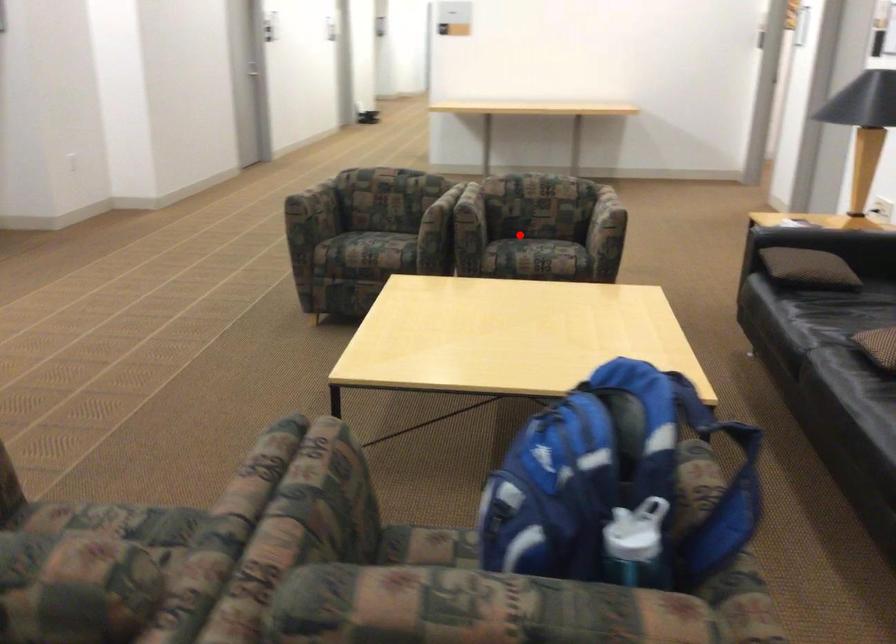
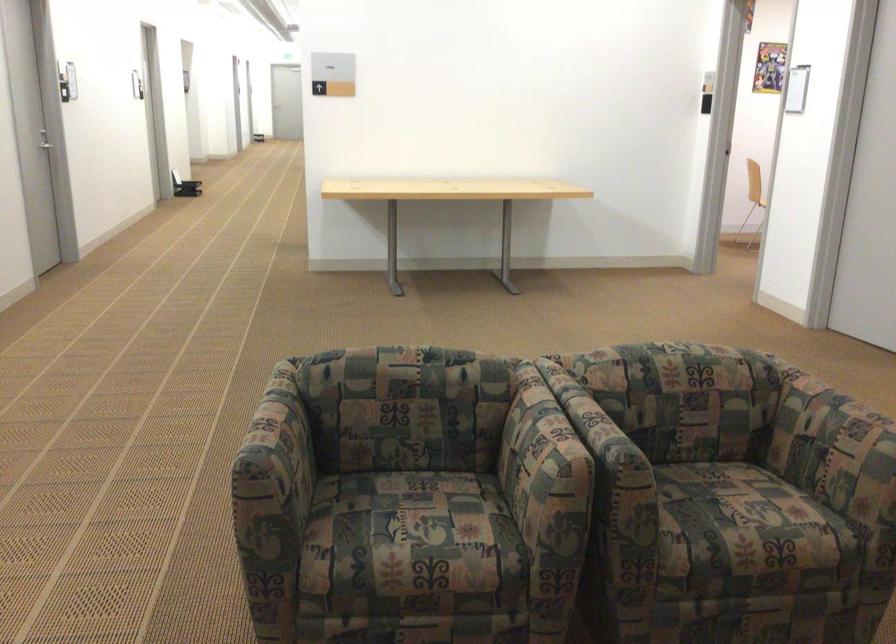
Question: I am providing you with two images of the same scene from different viewpoints. Given a red point in image1, look at the same physical point in image2. Is it:

Choices:
 (A) Closer to the viewpoint
 (B) Farther from the viewpoint

Answer: (A)